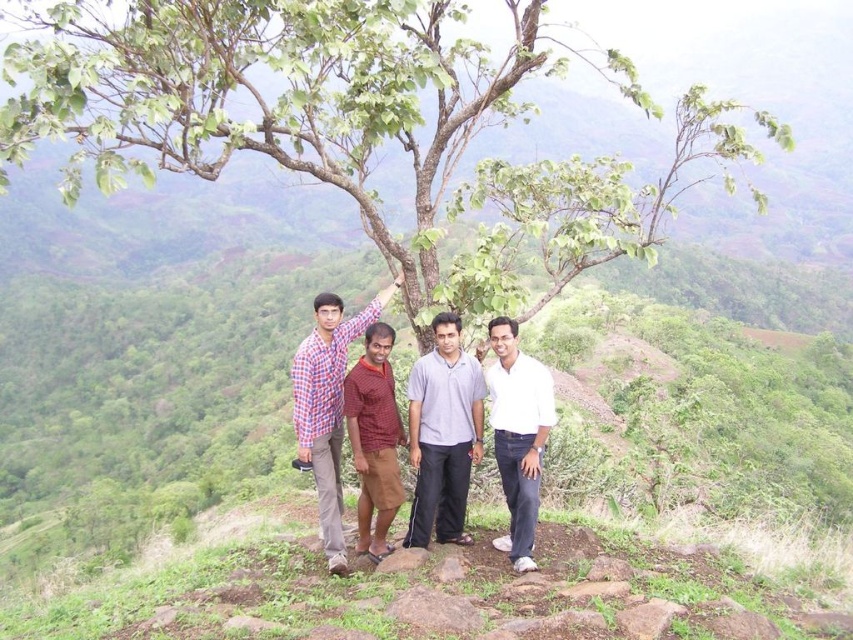
You are a photographer trying to capture a clear shot of the checkered fabric shirt at center. Based on the coordinates provided, where should you aim your camera to ensure the shirt is centered in your viewfinder?

You should aim your camera at the coordinates point (328, 406) to center the checkered fabric shirt at center in your viewfinder.

You are a photographer trying to capture a group photo. You notice two people wearing light gray cotton shirt at center and white cotton shirt at center. Which one is standing to the left of the other?

The light gray cotton shirt at center is positioned on the left side of white cotton shirt at center.